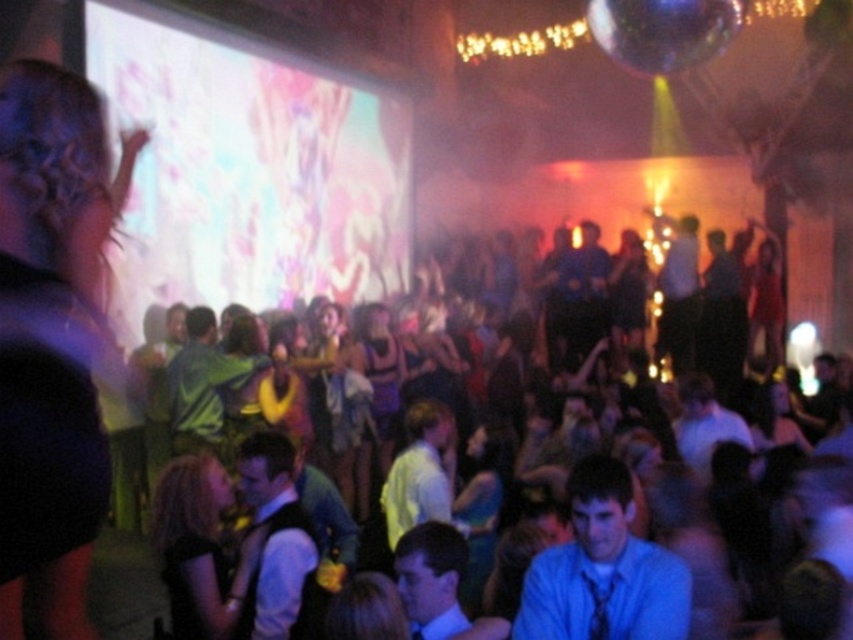
Measure the distance from white glossy projection screen at upper left to black satin dress at lower left.

The distance of white glossy projection screen at upper left from black satin dress at lower left is 13.06 feet.

Which of these two, white glossy projection screen at upper left or black satin dress at lower left, stands shorter?

With less height is black satin dress at lower left.

Which is in front, point (207, 68) or point (184, 481)?

Point (184, 481)

The height and width of the screenshot is (640, 853). In order to click on white glossy projection screen at upper left in this screenshot , I will do `click(247, 170)`.

Can you confirm if white glossy projection screen at upper left is smaller than shiny purple dress at center?

No.

Is white glossy projection screen at upper left to the right of shiny purple dress at center from the viewer's perspective?

In fact, white glossy projection screen at upper left is to the left of shiny purple dress at center.

Is point (119, 109) in front of point (368, 358)?

Yes, point (119, 109) is closer to viewer.

Locate an element on the screen. white glossy projection screen at upper left is located at coordinates (247, 170).

Is point (165, 576) more distant than point (358, 330)?

No.

Who is lower down, black satin dress at lower left or shiny purple dress at center?

black satin dress at lower left is lower down.

Find the location of a particular element. The width and height of the screenshot is (853, 640). black satin dress at lower left is located at coordinates (194, 547).